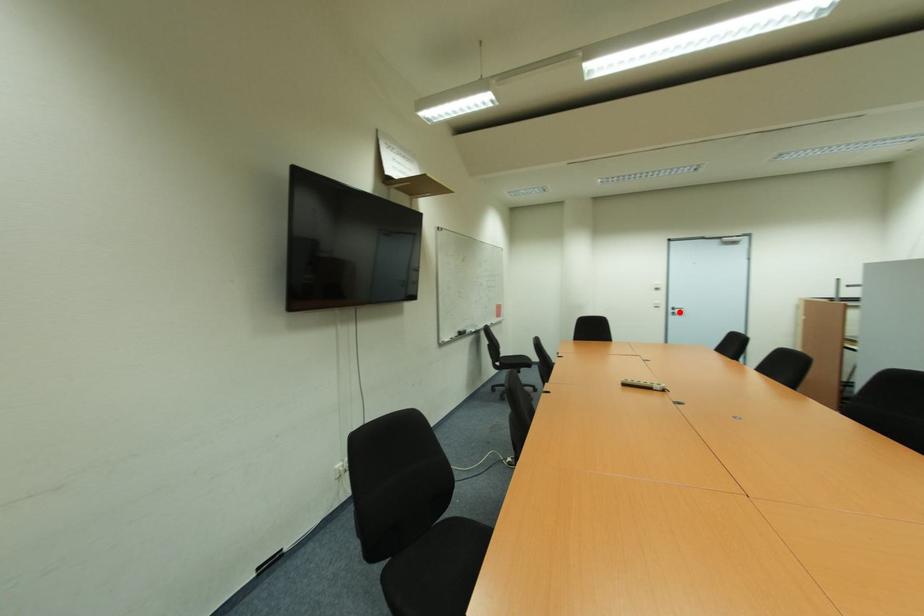
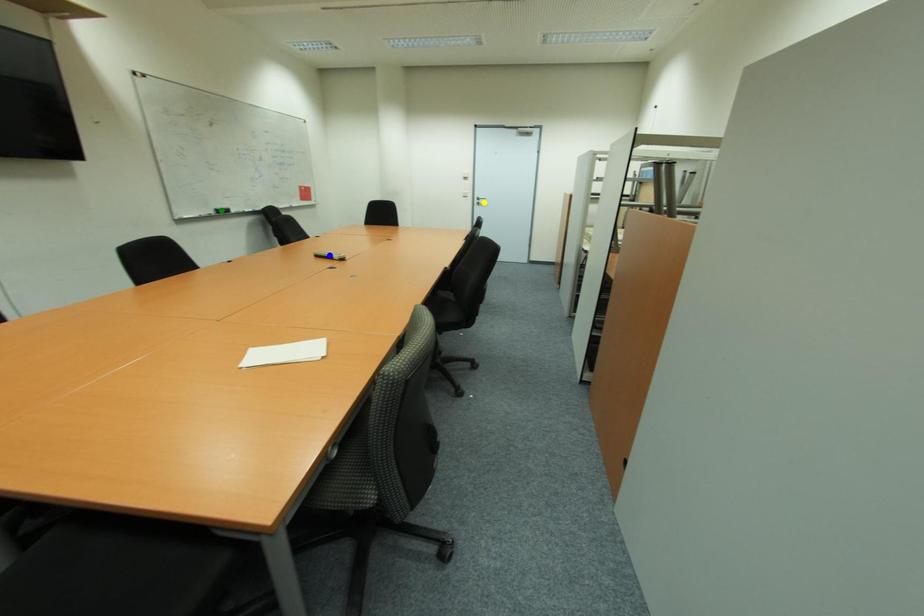
Question: I am providing you with two images of the same scene from different viewpoints. A red point is marked on the first image. You are given multiple points on the second image. Which spot in image 2 lines up with the point in image 1?

Choices:
 (A) yellow point
 (B) green point
 (C) blue point

Answer: (A)